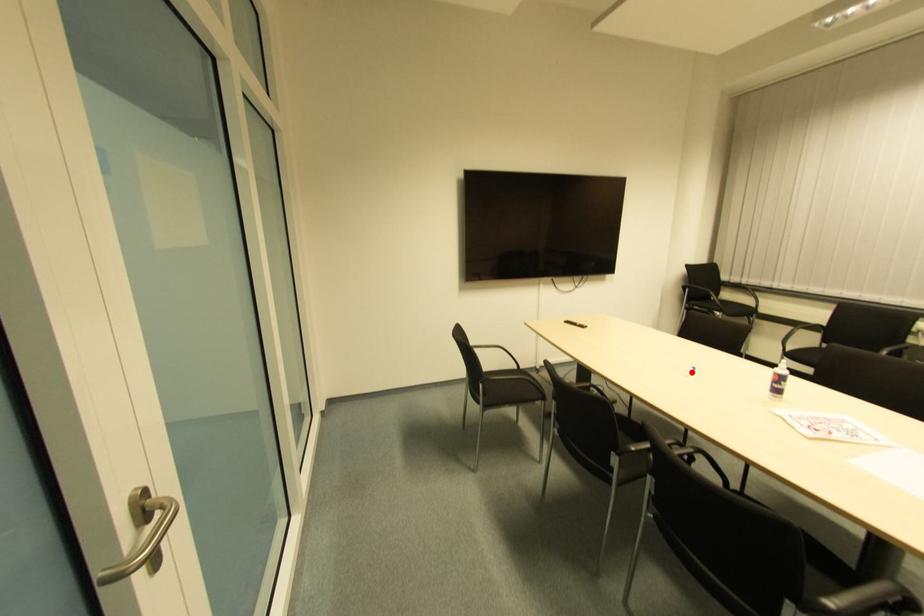
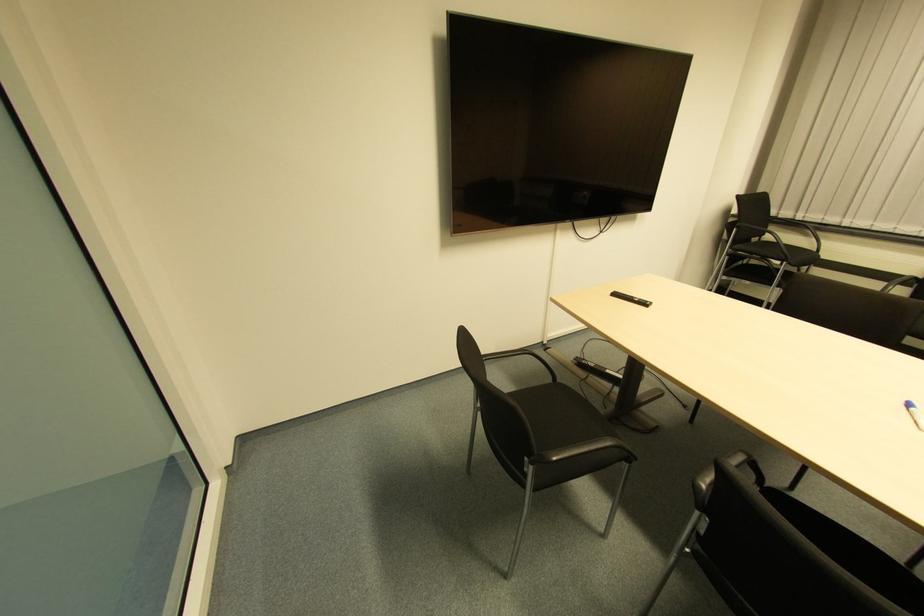
Question: I am providing you with two images of the same scene from different viewpoints. In image1, a red point is highlighted. Considering the same 3D point in image2, which of the following is correct?

Choices:
 (A) It is closer
 (B) It is farther

Answer: (B)